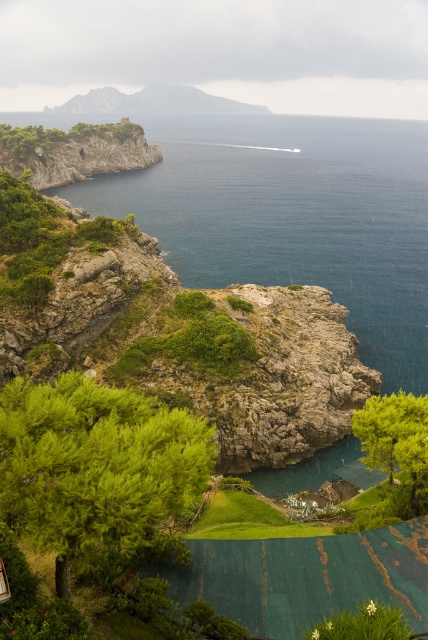
Can you confirm if green leafy tree at lower left is positioned to the left of green grassy hillside at upper center?

Incorrect, green leafy tree at lower left is not on the left side of green grassy hillside at upper center.

At what (x,y) coordinates should I click in order to perform the action: click on green leafy tree at lower left. Please return your answer as a coordinate pair (x, y). Looking at the image, I should click on (98, 474).

Can you confirm if deep blue water at upper center is smaller than green grassy hillside at upper center?

Incorrect, deep blue water at upper center is not smaller in size than green grassy hillside at upper center.

Does deep blue water at upper center have a larger size compared to green grassy hillside at upper center?

Yes, deep blue water at upper center is bigger than green grassy hillside at upper center.

Between point (401, 241) and point (211, 100), which one is positioned in front?

Point (401, 241)

At what (x,y) coordinates should I click in order to perform the action: click on deep blue water at upper center. Please return your answer as a coordinate pair (x, y). The image size is (428, 640). Looking at the image, I should click on (291, 216).

Looking at this image, who is shorter, green leafy tree at center or green grassy hillside at upper center?

Standing shorter between the two is green leafy tree at center.

Who is more distant from viewer, (x=377, y=401) or (x=154, y=99)?

Positioned behind is point (x=154, y=99).

Locate an element on the screen. The width and height of the screenshot is (428, 640). green leafy tree at center is located at coordinates (395, 438).